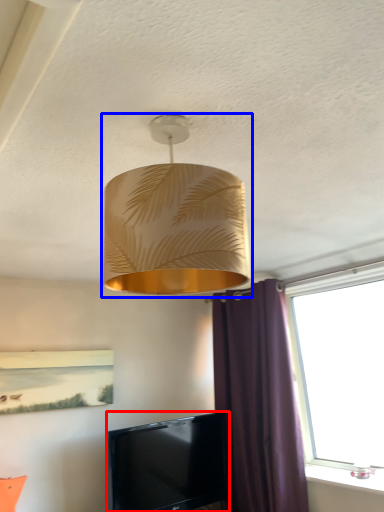
Question: Which object appears farthest to the camera in this image, television (highlighted by a red box) or lamp (highlighted by a blue box)?

Choices:
 (A) television
 (B) lamp

Answer: (A)